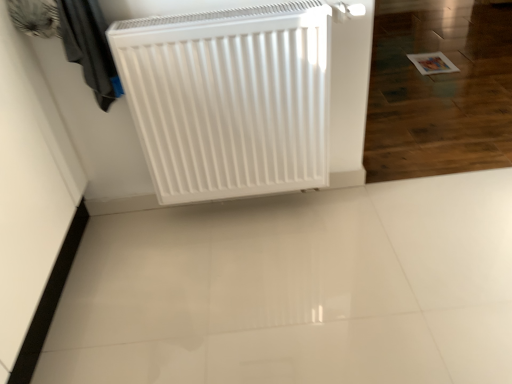
What is the approximate height of white matte radiator at center?

white matte radiator at center is 25.55 inches in height.

Describe the element at coordinates (229, 99) in the screenshot. I see `white matte radiator at center` at that location.

The image size is (512, 384). I want to click on white matte radiator at center, so click(x=229, y=99).

The width and height of the screenshot is (512, 384). Find the location of `white matte radiator at center`. white matte radiator at center is located at coordinates (229, 99).